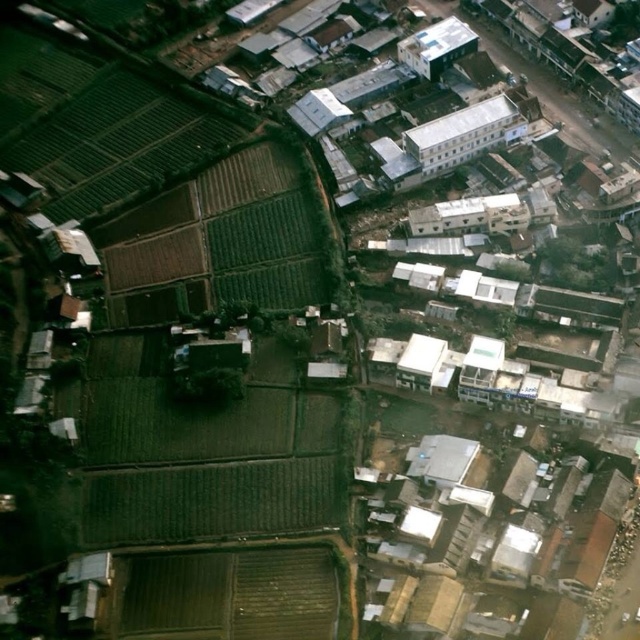
In the scene shown: Which is more to the left, white smooth building at center or white matte building at upper center?

white matte building at upper center

Find the location of a particular element. This screenshot has width=640, height=640. white smooth building at center is located at coordinates (461, 134).

You are a GUI agent. You are given a task and a screenshot of the screen. Output one action in this format:
    pyautogui.click(x=<x>, y=<y>)
    Task: Click on the white smooth building at center
    
    Given the screenshot: What is the action you would take?
    pyautogui.click(x=461, y=134)